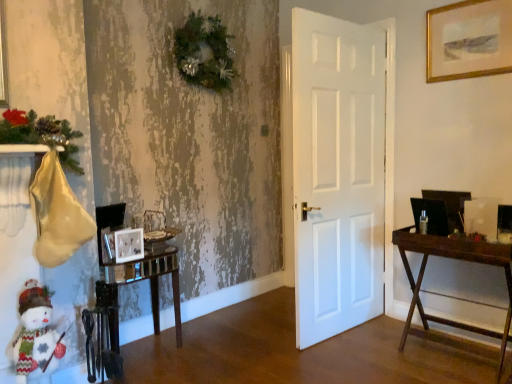
This screenshot has height=384, width=512. Identify the location of free location to the right of clear glass table at lower left. (203, 354).